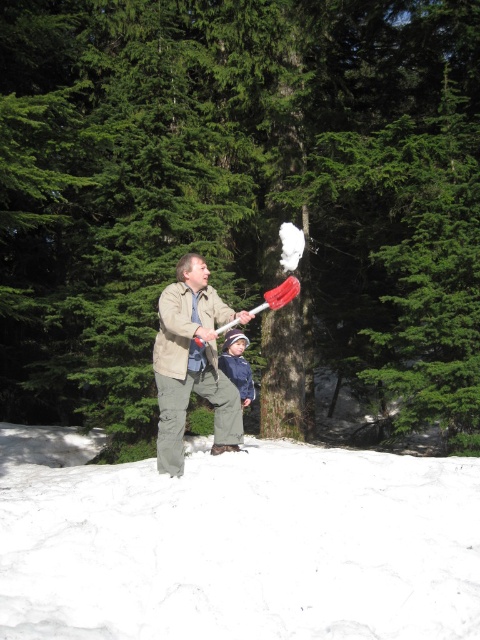
Is green textured tree at center below blue denim jacket at center?

Actually, green textured tree at center is above blue denim jacket at center.

Is the position of green textured tree at center less distant than that of blue denim jacket at center?

Yes, it is.

Does point (279, 147) lie in front of point (231, 372)?

No.

Where is `green textured tree at center`? Image resolution: width=480 pixels, height=640 pixels. green textured tree at center is located at coordinates (240, 202).

Does matte khaki jacket at center appear over blue denim jacket at center?

Yes.

Which is in front, point (218, 300) or point (220, 365)?

Positioned in front is point (218, 300).

Where is `matte khaki jacket at center`? The image size is (480, 640). matte khaki jacket at center is located at coordinates click(192, 364).

Between point (260, 428) and point (192, 632), which one is positioned behind?

The point (260, 428) is more distant.

From the picture: Can you confirm if green textured tree at center is thinner than white fluffy snow at lower center?

In fact, green textured tree at center might be wider than white fluffy snow at lower center.

Between point (12, 289) and point (11, 529), which one is positioned in front?

Point (11, 529)

Image resolution: width=480 pixels, height=640 pixels. I want to click on green textured tree at center, so point(240,202).